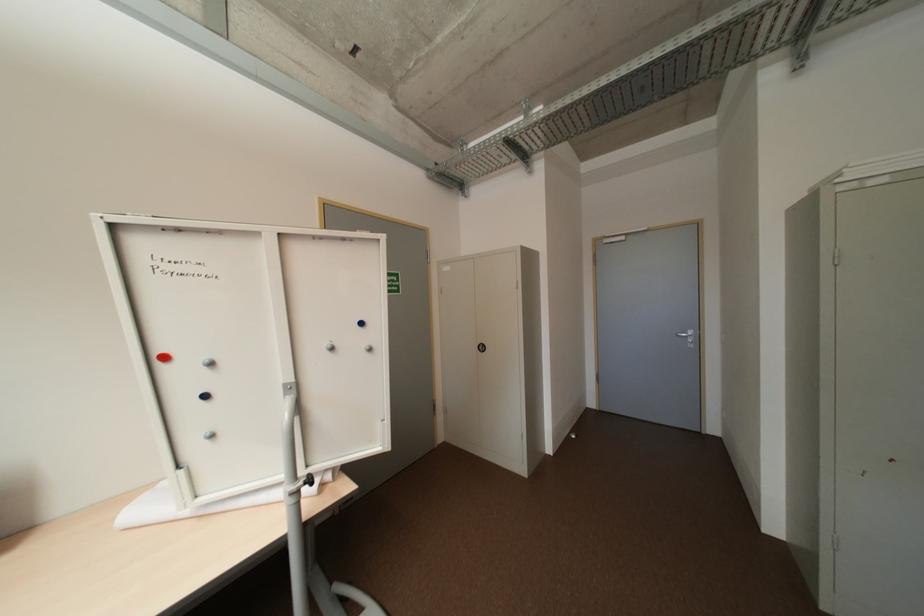
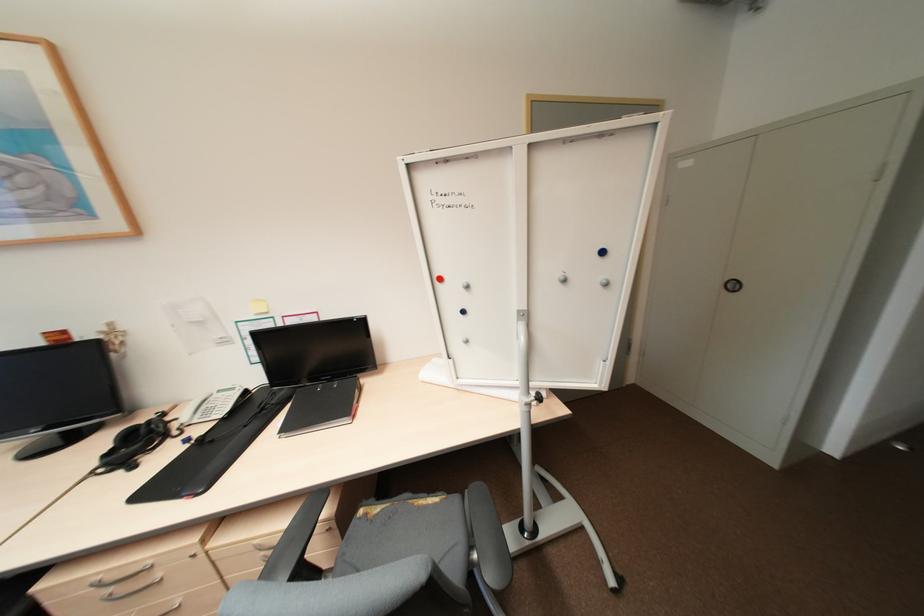
Find the pixel in the second image that matches point 217,436 in the first image.

(472, 341)